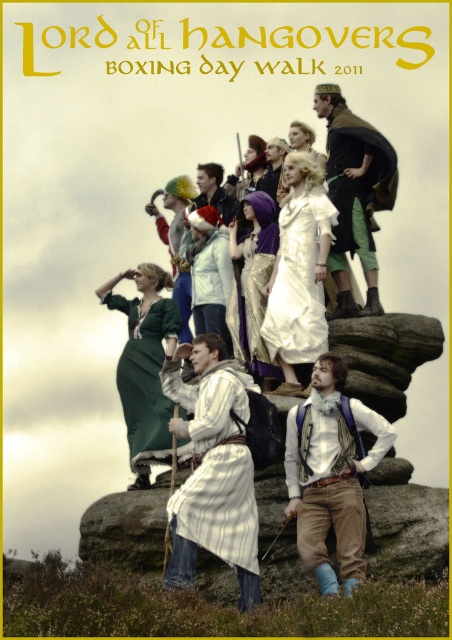
Does green velvet dress at center have a lesser width compared to matte white shirt at center?

No.

Can you confirm if green velvet dress at center is smaller than matte white shirt at center?

Actually, green velvet dress at center might be larger than matte white shirt at center.

Who is more forward, (132, 442) or (221, 196)?

Positioned in front is point (132, 442).

Image resolution: width=452 pixels, height=640 pixels. I want to click on green velvet dress at center, so click(145, 378).

Image resolution: width=452 pixels, height=640 pixels. Describe the element at coordinates (330, 474) in the screenshot. I see `light brown corduroy pants at center` at that location.

Is point (323, 502) positioned after point (279, 321)?

No, (323, 502) is in front of (279, 321).

This screenshot has width=452, height=640. Find the location of `light brown corduroy pants at center`. light brown corduroy pants at center is located at coordinates (330, 474).

Does green fabric cape at upper right have a greater width compared to green velvet dress at center?

Incorrect, green fabric cape at upper right's width does not surpass green velvet dress at center's.

Locate an element on the screen. The image size is (452, 640). green fabric cape at upper right is located at coordinates (354, 193).

The width and height of the screenshot is (452, 640). Find the location of `green fabric cape at upper right`. green fabric cape at upper right is located at coordinates (354, 193).